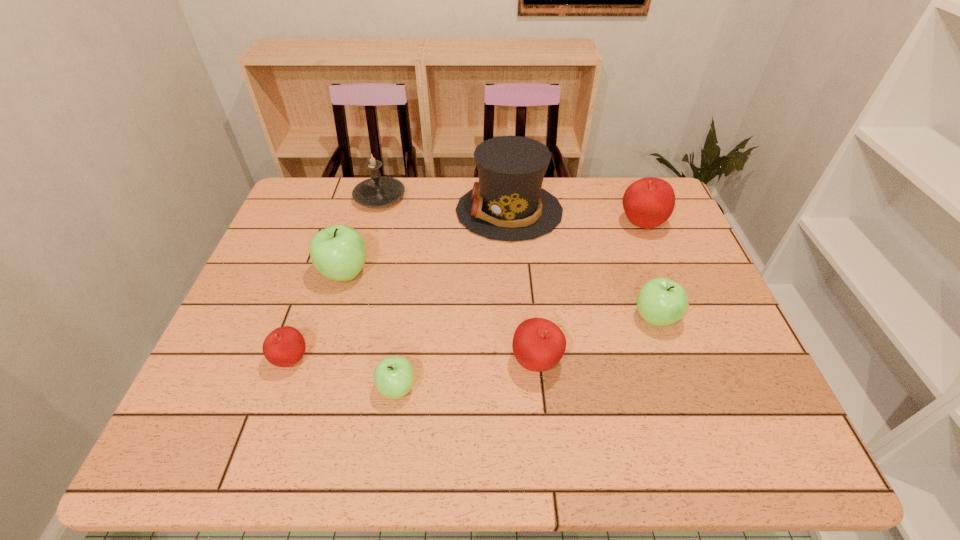
Image resolution: width=960 pixels, height=540 pixels. In the image, there is a desktop. Identify the location of vacant space at the left edge. (285, 325).

Where is `free space at the right edge`? free space at the right edge is located at coordinates click(x=696, y=269).

At what (x,y) coordinates should I click in order to perform the action: click on free space at the far left corner of the desktop. Please return your answer as a coordinate pair (x, y). Looking at the image, I should click on (302, 222).

Identify the location of vacant space at the near left corner. (185, 454).

Where is `free space between the dress hat and the biggest red apple`? The image size is (960, 540). free space between the dress hat and the biggest red apple is located at coordinates pos(575,218).

Locate an element on the screen. vacant point located between the leftmost red apple and the fourth nearest object is located at coordinates coord(473,339).

Find the location of a particular element. free spot between the leftmost green apple and the second green apple from left to right is located at coordinates (372, 330).

Where is `free space between the third apple from right to left and the second biggest green apple`? This screenshot has width=960, height=540. free space between the third apple from right to left and the second biggest green apple is located at coordinates (596, 340).

Locate an element on the screen. Image resolution: width=960 pixels, height=540 pixels. vacant area that lies between the third apple from left to right and the candle is located at coordinates (389, 293).

Where is `free point between the second biggest red apple and the candle`? free point between the second biggest red apple and the candle is located at coordinates (458, 280).